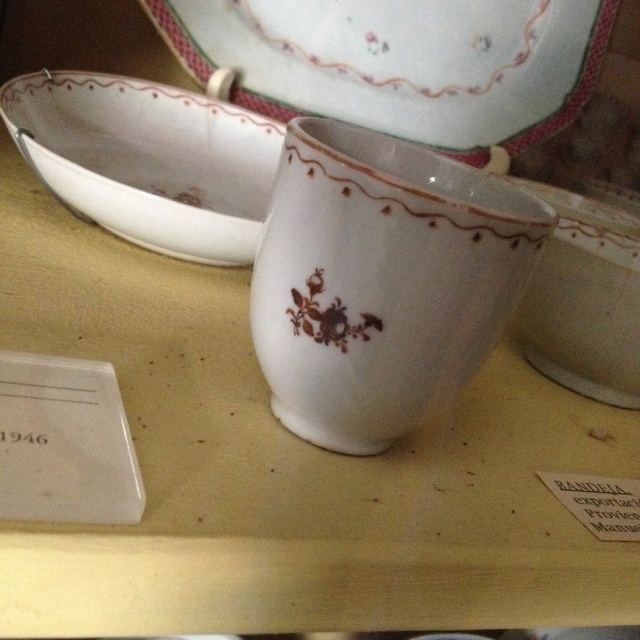
Can you confirm if white porcelain cup at center is shorter than white porcelain bowl at upper left?

Incorrect, white porcelain cup at center's height does not fall short of white porcelain bowl at upper left's.

Where is `white porcelain cup at center`? white porcelain cup at center is located at coordinates (380, 280).

Does white porcelain cup at center appear on the left side of white porcelain bowl at center?

Correct, you'll find white porcelain cup at center to the left of white porcelain bowl at center.

Does point (449, 368) lie in front of point (611, 300)?

Yes, it is in front of point (611, 300).

Between point (522, 228) and point (616, 392), which one is positioned behind?

The point (616, 392) is more distant.

Image resolution: width=640 pixels, height=640 pixels. I want to click on white porcelain cup at center, so click(380, 280).

Image resolution: width=640 pixels, height=640 pixels. Describe the element at coordinates (401, 61) in the screenshot. I see `white porcelain plate at upper center` at that location.

Is point (576, 49) positioned behind point (51, 115)?

Yes, it is.

Does point (205, 20) lie behind point (122, 122)?

Yes, point (205, 20) is farther from viewer.

Where is `white porcelain plate at upper center`? Image resolution: width=640 pixels, height=640 pixels. white porcelain plate at upper center is located at coordinates (401, 61).